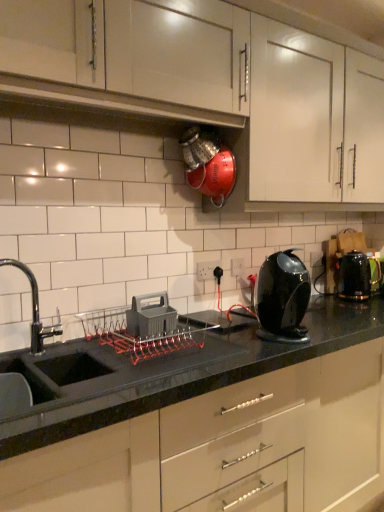
Find the location of a particular element. white matte cabinet at upper center, the second cabinetry positioned from the top is located at coordinates (313, 119).

Describe the element at coordinates (151, 316) in the screenshot. I see `gray plastic dish rack at center` at that location.

In order to face gray plastic dish rack at center, should I rotate leftwards or rightwards?

You should rotate left by 5.740 degrees.

Describe the element at coordinates (134, 48) in the screenshot. I see `white glossy cabinet at upper center, the 3th cabinetry from the bottom` at that location.

Describe the element at coordinates (356, 276) in the screenshot. The width and height of the screenshot is (384, 512). I see `black glossy kettle at right` at that location.

Find the location of a particular element. black plastic electric outlet at center, the first electric outlet in the back-to-front sequence is located at coordinates (237, 266).

The image size is (384, 512). I want to click on white plastic electric outlet at center, the 1th electric outlet viewed from the front, so click(x=207, y=270).

Measure the distance between glossy black kettle at center-right and camera.

A distance of 1.46 meters exists between glossy black kettle at center-right and camera.

Locate an element on the screen. glossy black kettle at center-right is located at coordinates (282, 298).

Locate an element on the screen. white matte cabinet at upper center, marked as the 2th cabinetry in a bottom-to-top arrangement is located at coordinates (313, 119).

Considering the relative positions of white plastic electric outlet at center, the second electric outlet when ordered from right to left, and white matte cabinet at upper center, marked as the 2th cabinetry in a bottom-to-top arrangement, in the image provided, is white plastic electric outlet at center, the second electric outlet when ordered from right to left, in front of white matte cabinet at upper center, marked as the 2th cabinetry in a bottom-to-top arrangement,?

No, the depth of white plastic electric outlet at center, the second electric outlet when ordered from right to left, is greater than that of white matte cabinet at upper center, marked as the 2th cabinetry in a bottom-to-top arrangement.

How many degrees apart are the facing directions of white plastic electric outlet at center, the 1th electric outlet viewed from the front, and white matte cabinet at upper center, marked as the 2th cabinetry in a bottom-to-top arrangement?

There is a 0.627-degree angle between the facing directions of white plastic electric outlet at center, the 1th electric outlet viewed from the front, and white matte cabinet at upper center, marked as the 2th cabinetry in a bottom-to-top arrangement.

Does white plastic electric outlet at center, which is counted as the first electric outlet, starting from the left, have a greater height compared to white matte cabinet at upper center, marked as the 2th cabinetry in a bottom-to-top arrangement?

In fact, white plastic electric outlet at center, which is counted as the first electric outlet, starting from the left, may be shorter than white matte cabinet at upper center, marked as the 2th cabinetry in a bottom-to-top arrangement.

Is white plastic electric outlet at center, which is counted as the first electric outlet, starting from the left, positioned with its back to white matte cabinet at upper center, marked as the 2th cabinetry in a bottom-to-top arrangement?

white plastic electric outlet at center, which is counted as the first electric outlet, starting from the left, is not turned away from white matte cabinet at upper center, marked as the 2th cabinetry in a bottom-to-top arrangement.

Looking at this image, from a real-world perspective, which is physically above, white glossy cabinet at upper center, the 3th cabinetry from the bottom, or gray plastic dish rack at center?

From a 3D spatial view, white glossy cabinet at upper center, the 3th cabinetry from the bottom, is above.

From the image's perspective, is white glossy cabinet at upper center, which is the 1th cabinetry from top to bottom, positioned above or below gray plastic dish rack at center?

Based on their image positions, white glossy cabinet at upper center, which is the 1th cabinetry from top to bottom, is located above gray plastic dish rack at center.

Which is closer to the camera, (152, 6) or (160, 319)?

Positioned in front is point (152, 6).

Measure the distance from white glossy cabinet at upper center, the 3th cabinetry from the bottom, to gray plastic dish rack at center.

33.54 inches.

Does point (140, 509) come closer to viewer compared to point (336, 144)?

Yes, it is.

Would you say black glossy countertop at center, marked as the first cabinetry in a bottom-to-top arrangement, contains white matte cabinet at upper center, marked as the 2th cabinetry in a bottom-to-top arrangement?

No, white matte cabinet at upper center, marked as the 2th cabinetry in a bottom-to-top arrangement, is not inside black glossy countertop at center, marked as the first cabinetry in a bottom-to-top arrangement.

Where is `cabinetry that appears below the white matte cabinet at upper center, the second cabinetry positioned from the top (from the image's perspective)`? cabinetry that appears below the white matte cabinet at upper center, the second cabinetry positioned from the top (from the image's perspective) is located at coordinates (226, 448).

Does gray plastic dish rack at center turn towards white glossy cabinet at upper center, the 3th cabinetry from the bottom?

No, gray plastic dish rack at center does not turn towards white glossy cabinet at upper center, the 3th cabinetry from the bottom.

In terms of width, does gray plastic dish rack at center look wider or thinner when compared to white glossy cabinet at upper center, the 3th cabinetry from the bottom?

In the image, gray plastic dish rack at center appears to be more narrow than white glossy cabinet at upper center, the 3th cabinetry from the bottom.

How many degrees apart are the facing directions of gray plastic dish rack at center and white glossy cabinet at upper center, which is the 1th cabinetry from top to bottom?

The angle between the facing direction of gray plastic dish rack at center and the facing direction of white glossy cabinet at upper center, which is the 1th cabinetry from top to bottom, is 1.31 degrees.

From a real-world perspective, is gray plastic dish rack at center located higher than white glossy cabinet at upper center, the 3th cabinetry from the bottom?

No, from a real-world perspective, gray plastic dish rack at center is not above white glossy cabinet at upper center, the 3th cabinetry from the bottom.

Is glossy black kettle at center-right wider or thinner than black glossy countertop at center, which ranks as the 3th cabinetry in top-to-bottom order?

glossy black kettle at center-right is thinner than black glossy countertop at center, which ranks as the 3th cabinetry in top-to-bottom order.

Consider the image. From the image's perspective, is glossy black kettle at center-right below black glossy countertop at center, which ranks as the 3th cabinetry in top-to-bottom order?

No.

Does glossy black kettle at center-right appear on the right side of black glossy countertop at center, which ranks as the 3th cabinetry in top-to-bottom order?

In fact, glossy black kettle at center-right is to the left of black glossy countertop at center, which ranks as the 3th cabinetry in top-to-bottom order.

Are glossy black kettle at center-right and black glossy countertop at center, marked as the first cabinetry in a bottom-to-top arrangement, beside each other?

No, glossy black kettle at center-right is not beside black glossy countertop at center, marked as the first cabinetry in a bottom-to-top arrangement.

Is glossy black kettle at center-right positioned beyond the bounds of gray plastic dish rack at center?

Yes.

Is glossy black kettle at center-right far from gray plastic dish rack at center?

No, there isn't a large distance between glossy black kettle at center-right and gray plastic dish rack at center.

Between glossy black kettle at center-right and gray plastic dish rack at center, which one has smaller width?

Thinner between the two is gray plastic dish rack at center.

From a real-world perspective, is glossy black kettle at center-right positioned above or below gray plastic dish rack at center?

glossy black kettle at center-right is above gray plastic dish rack at center.

Between point (300, 177) and point (240, 264), which one is positioned in front?

The point (300, 177) is closer.

Is white matte cabinet at upper center, marked as the 2th cabinetry in a bottom-to-top arrangement, oriented away from black plastic electric outlet at center, which is counted as the first electric outlet, starting from the right?

That's not correct — white matte cabinet at upper center, marked as the 2th cabinetry in a bottom-to-top arrangement, is not looking away from black plastic electric outlet at center, which is counted as the first electric outlet, starting from the right.

From the image's perspective, does white matte cabinet at upper center, marked as the 2th cabinetry in a bottom-to-top arrangement, appear lower than black plastic electric outlet at center, the first electric outlet in the back-to-front sequence?

No.

From a real-world perspective, which is physically below, white matte cabinet at upper center, marked as the 2th cabinetry in a bottom-to-top arrangement, or black plastic electric outlet at center, which ranks as the 2th electric outlet in front-to-back order?

Result: black plastic electric outlet at center, which ranks as the 2th electric outlet in front-to-back order, is physically lower.

In order to click on the 1st electric outlet behind when counting from the white matte cabinet at upper center, marked as the 2th cabinetry in a bottom-to-top arrangement in this screenshot , I will do `click(207, 270)`.

Locate an element on the screen. The width and height of the screenshot is (384, 512). cabinetry on the left side of gray plastic dish rack at center is located at coordinates (134, 48).

Which object lies nearer to the anchor point white matte cabinet at upper center, marked as the 2th cabinetry in a bottom-to-top arrangement, white glossy cabinet at upper center, the 3th cabinetry from the bottom, or black plastic electric outlet at center, acting as the 2th electric outlet starting from the left?

The object closer to white matte cabinet at upper center, marked as the 2th cabinetry in a bottom-to-top arrangement, is white glossy cabinet at upper center, the 3th cabinetry from the bottom.

Estimate the real-world distances between objects in this image. Which object is further from white glossy cabinet at upper center, the 3th cabinetry from the bottom, glossy black kettle at center-right or black glossy kettle at right?

Based on the image, black glossy kettle at right appears to be further to white glossy cabinet at upper center, the 3th cabinetry from the bottom.

Looking at the image, which one is located further to black glossy countertop at center, which ranks as the 3th cabinetry in top-to-bottom order, white matte cabinet at upper center, the second cabinetry positioned from the top, or gray plastic dish rack at center?

The object further to black glossy countertop at center, which ranks as the 3th cabinetry in top-to-bottom order, is white matte cabinet at upper center, the second cabinetry positioned from the top.

Based on their spatial positions, is white glossy cabinet at upper center, which is the 1th cabinetry from top to bottom, or black glossy kettle at right further from black plastic electric outlet at center, acting as the 2th electric outlet starting from the left?

white glossy cabinet at upper center, which is the 1th cabinetry from top to bottom, is positioned further to the anchor black plastic electric outlet at center, acting as the 2th electric outlet starting from the left.

Which object lies further to the anchor point black glossy kettle at right, glossy black kettle at center-right or white glossy cabinet at upper center, the 3th cabinetry from the bottom?

white glossy cabinet at upper center, the 3th cabinetry from the bottom, lies further to black glossy kettle at right than the other object.

Looking at the image, which one is located closer to white glossy cabinet at upper center, which is the 1th cabinetry from top to bottom, black plastic electric outlet at center, acting as the 2th electric outlet starting from the left, or white plastic electric outlet at center, which is counted as the first electric outlet, starting from the left?

Among the two, white plastic electric outlet at center, which is counted as the first electric outlet, starting from the left, is located nearer to white glossy cabinet at upper center, which is the 1th cabinetry from top to bottom.

Estimate the real-world distances between objects in this image. Which object is further from gray plastic dish rack at center, black glossy countertop at center, which ranks as the 3th cabinetry in top-to-bottom order, or glossy black kettle at center-right?

black glossy countertop at center, which ranks as the 3th cabinetry in top-to-bottom order.

Looking at the image, which one is located further to gray plastic dish rack at center, white matte cabinet at upper center, the second cabinetry positioned from the top, or white glossy cabinet at upper center, which is the 1th cabinetry from top to bottom?

white matte cabinet at upper center, the second cabinetry positioned from the top, is further to gray plastic dish rack at center.

Identify the location of electric outlet between white plastic electric outlet at center, marked as the second electric outlet in a back-to-front arrangement, and black glossy kettle at right, in the horizontal direction. The width and height of the screenshot is (384, 512). (237, 266).

Find the location of a particular element. This screenshot has width=384, height=512. appliance situated between white glossy cabinet at upper center, which is the 1th cabinetry from top to bottom, and black glossy kettle at right from left to right is located at coordinates (151, 316).

This screenshot has height=512, width=384. In order to click on electric outlet between gray plastic dish rack at center and black plastic electric outlet at center, which is counted as the first electric outlet, starting from the right, in the front-back direction in this screenshot , I will do `click(207, 270)`.

This screenshot has width=384, height=512. Identify the location of electric outlet between white matte cabinet at upper center, marked as the 2th cabinetry in a bottom-to-top arrangement, and white plastic electric outlet at center, the second electric outlet when ordered from right to left, in the vertical direction. (237, 266).